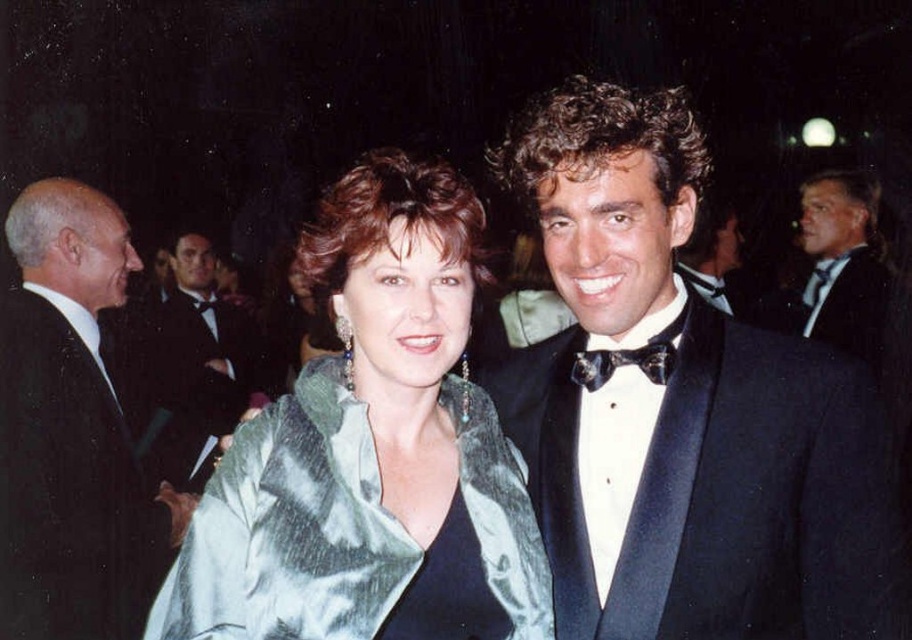
You are a photographer at an event and need to adjust the camera focus. You have two subjects in the frame wearing black satin tuxedo at center and black satin suit at left. Which one should you focus on if you want to capture the smaller one clearly?

The black satin tuxedo at center has a smaller size compared to the black satin suit at left, so you should focus on the black satin tuxedo at center to capture the smaller one clearly.

You are at a formal event and need to find the satin green coat at center and the black satin suit at left. According to the scene, which one is located to the right of the other?

The satin green coat at center is positioned on the right side of black satin suit at left.

You are standing at the entrance of the event and want to approach the black satin tuxedo at center to greet the person wearing it. Considering you need to maintain a 4 feet social distance, is the current distance sufficient for you to stay within the recommended guidelines without moving closer?

The distance between you and the black satin tuxedo at center is 3.95 feet, which is slightly less than the recommended 4 feet social distance. Therefore, you should move back slightly to maintain the required distance.